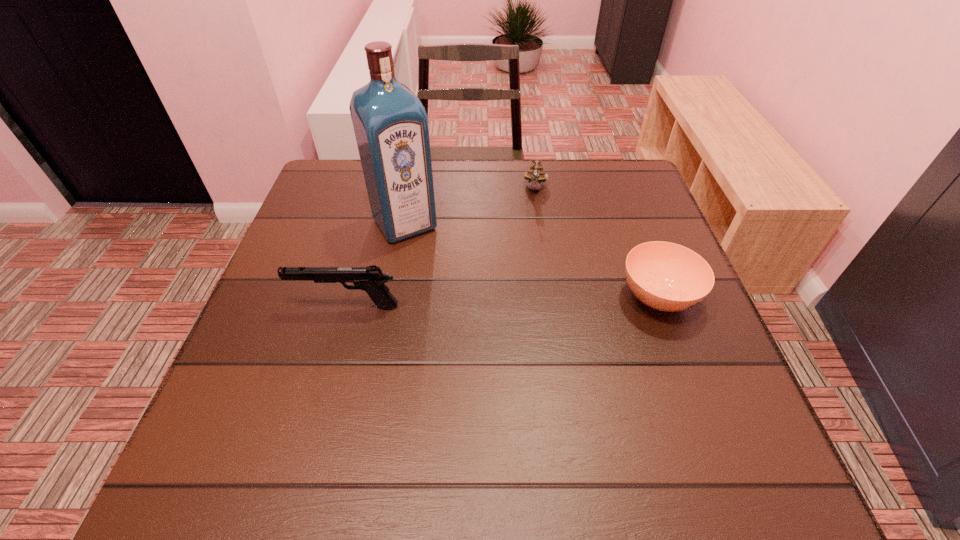
Find the location of `vacant area that lies between the soup bowl and the gun`. vacant area that lies between the soup bowl and the gun is located at coordinates (502, 301).

At what (x,y) coordinates should I click in order to perform the action: click on empty space that is in between the third nearest object and the farthest object. Please return your answer as a coordinate pair (x, y). The image size is (960, 540). Looking at the image, I should click on (470, 206).

The height and width of the screenshot is (540, 960). Identify the location of vacant space that is in between the snail and the liquor. (470, 206).

In order to click on vacant space that is in between the gun and the tallest object in this screenshot , I will do `click(376, 265)`.

Identify which object is the third nearest to the tallest object. Please provide its 2D coordinates. Your answer should be formatted as a tuple, i.e. [(x, y)], where the tuple contains the x and y coordinates of a point satisfying the conditions above.

[(665, 276)]

Locate which object is the third closest to the farthest object. Please provide its 2D coordinates. Your answer should be formatted as a tuple, i.e. [(x, y)], where the tuple contains the x and y coordinates of a point satisfying the conditions above.

[(371, 279)]